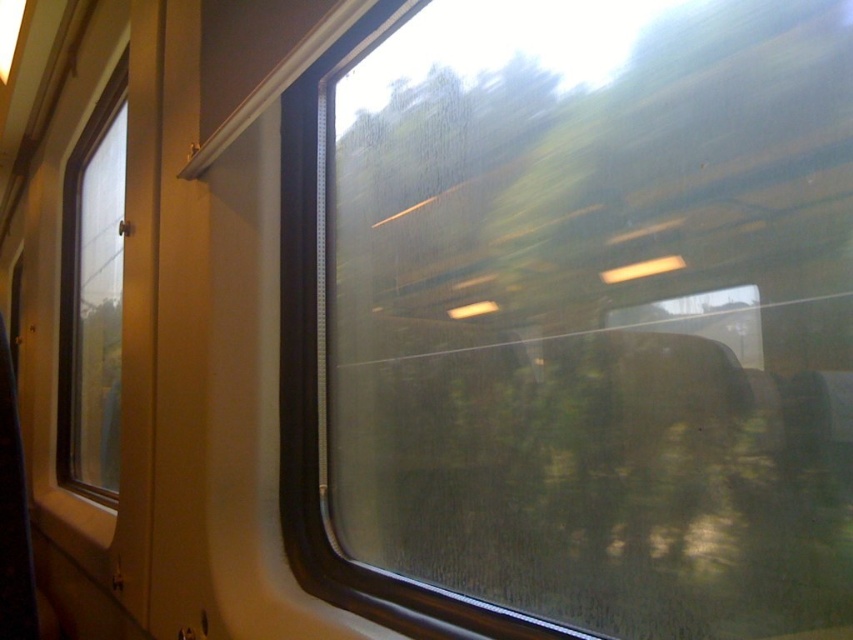
You are sitting in the train and want to look outside. You notice two windows, the transparent glass train window at center and the transparent glass window at left. Which window is lower in position?

The transparent glass train window at center is positioned under the transparent glass window at left, so it is lower in position.

You are sitting in the train and want to look outside. You notice two windows, the transparent glass train window at center and the transparent glass window at left. Which window is positioned to the right side of the other?

The transparent glass train window at center is positioned to the right of the transparent glass window at left.

You are sitting in the train and want to take a photo through the window. Which window, the transparent glass train window at center or the transparent glass window at left, allows you to see more of the scenery above the train?

The transparent glass window at left allows you to see more of the scenery above the train because it has a greater height compared to the transparent glass train window at center.